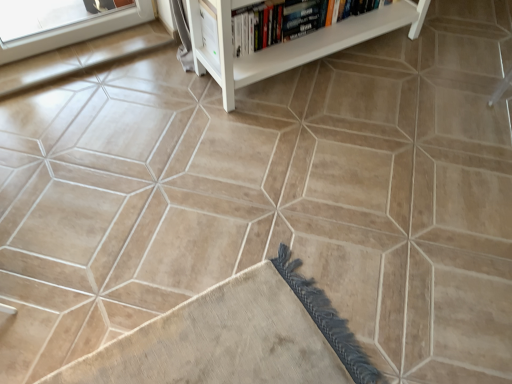
At what (x,y) coordinates should I click in order to perform the action: click on blank area beneath white matte shelf at upper center (from a real-world perspective). Please return your answer as a coordinate pair (x, y). Looking at the image, I should click on (318, 68).